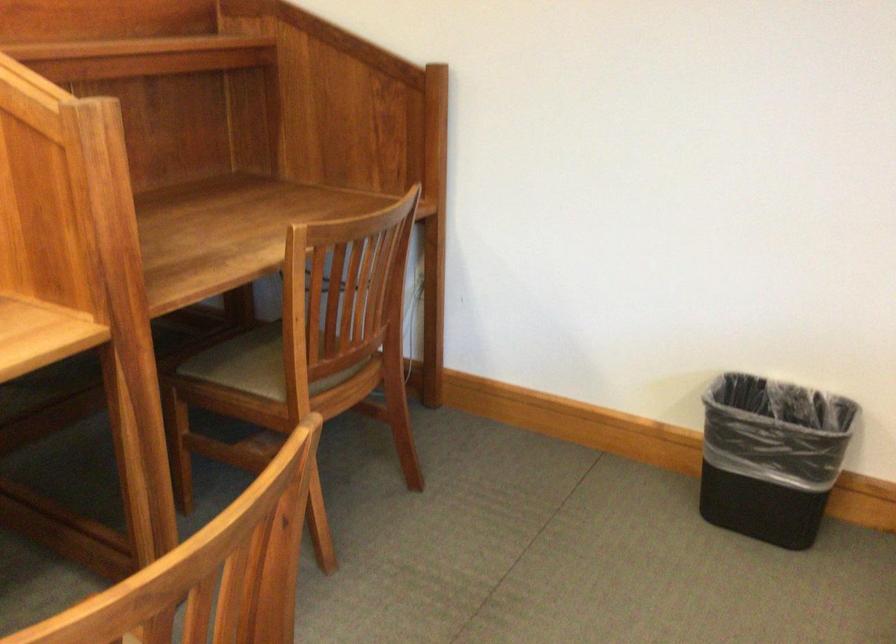
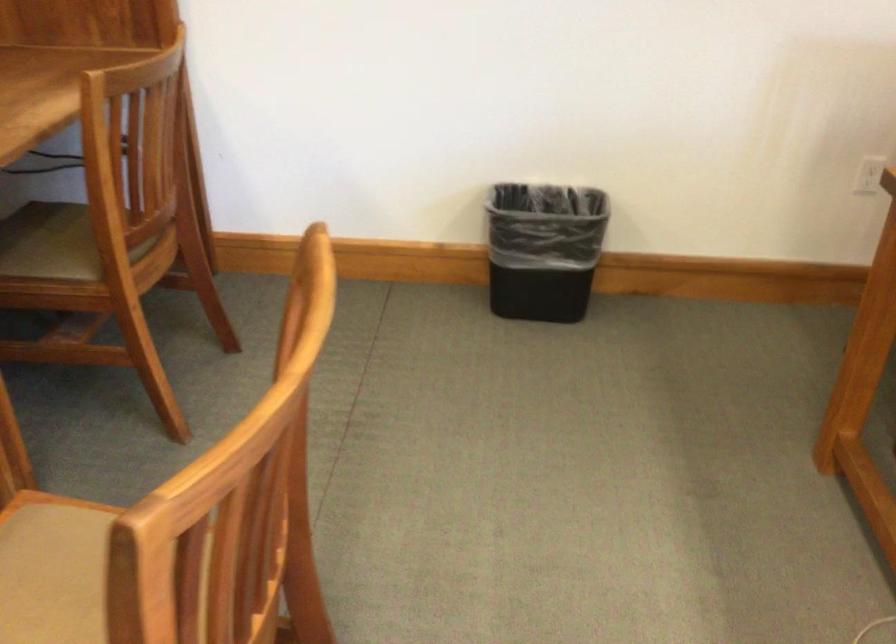
Question: The images are taken continuously from a first-person perspective. In which direction is your viewpoint rotating?

Choices:
 (A) Left
 (B) Right
 (C) Up
 (D) Down

Answer: (B)